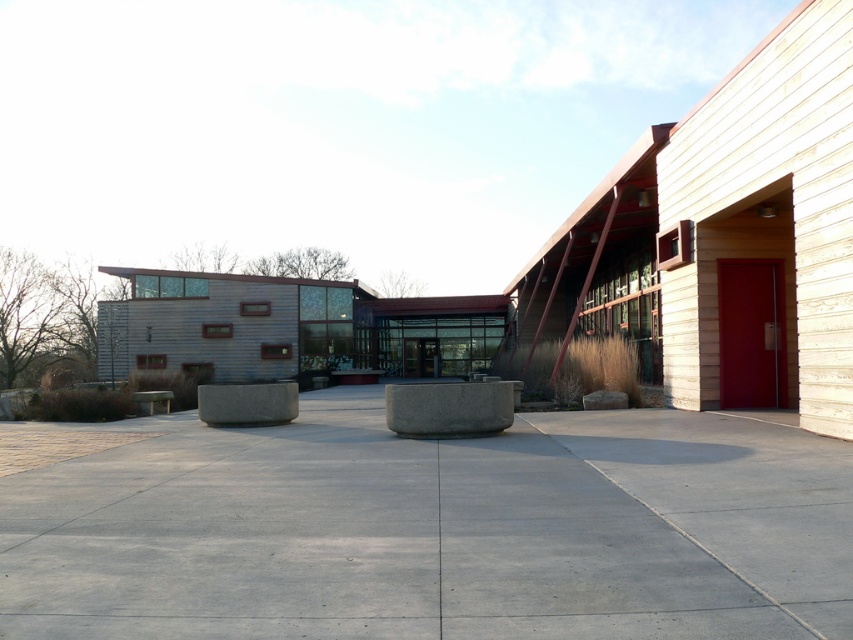
You are standing at the entrance of the building and want to walk to the gray concrete pavement at center. According to the coordinates provided, in which direction should you move relative to the building?

The gray concrete pavement at center is located at coordinates point (x=425, y=528). Since the coordinates are based on a standard grid system where the origin is at the bottom left corner, moving towards higher x values means moving to the right and higher y values mean moving upwards. Therefore, to reach the gray concrete pavement at center, you should move to the right and slightly upwards from the entrance.

You are standing in front of the modern building and see the gray concrete planter at center and the gray concrete at center. Which object is positioned to the right side?

The gray concrete planter at center is to the right of the gray concrete at center.